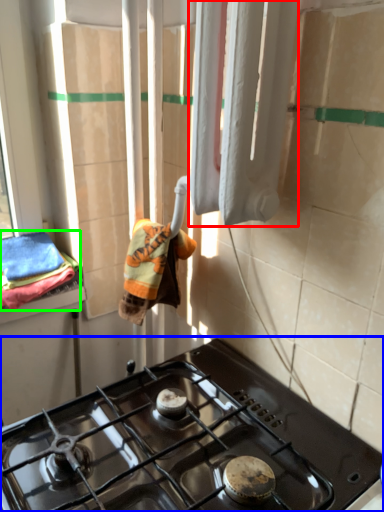
Question: Which is nearer to the curtain (highlighted by a red box)? gas stove (highlighted by a blue box) or bath towel (highlighted by a green box).

Choices:
 (A) gas stove
 (B) bath towel

Answer: (A)